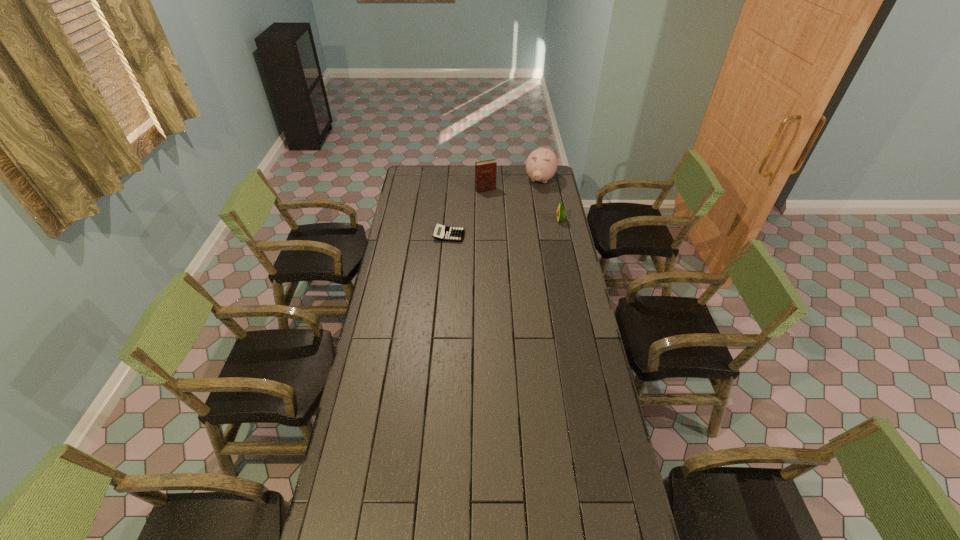
Identify the location of vacant space located 0.170m on the front cover of the third object from right to left. The image size is (960, 540). (498, 209).

Locate an element on the screen. Image resolution: width=960 pixels, height=540 pixels. vacant region located on the front cover of the third object from right to left is located at coordinates (506, 221).

What are the coordinates of `vacant space located 0.140m on the front cover of the third object from right to left` in the screenshot? It's located at (497, 206).

This screenshot has width=960, height=540. What are the coordinates of `vacant space situated 0.330m at the snout of the piggy bank` in the screenshot? It's located at point(523,223).

Identify the location of vacant area located at the snout of the piggy bank. The width and height of the screenshot is (960, 540). (532, 202).

The height and width of the screenshot is (540, 960). Identify the location of vacant point located at the snout of the piggy bank. [532, 204].

Locate an element on the screen. This screenshot has width=960, height=540. object that is positioned at the far edge is located at coordinates (541, 165).

Identify the location of avocado that is at the right edge. The width and height of the screenshot is (960, 540). (561, 213).

At what (x,y) coordinates should I click in order to perform the action: click on piggy bank that is at the right edge. Please return your answer as a coordinate pair (x, y). Looking at the image, I should click on (541, 165).

Where is `object that is positioned at the far right corner`? The width and height of the screenshot is (960, 540). object that is positioned at the far right corner is located at coordinates (541, 165).